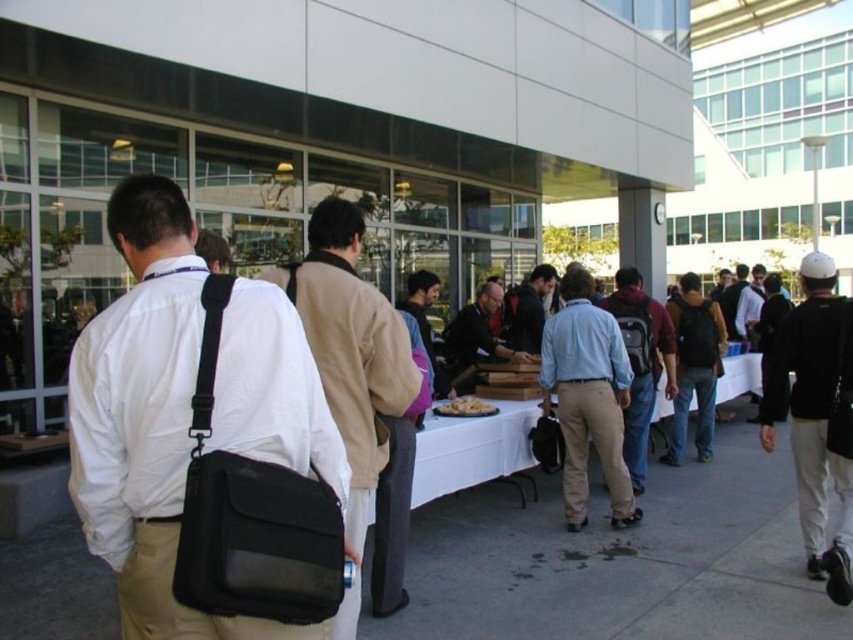
Question: Is black cotton jacket at right bigger than light blue cotton shirt at center?

Choices:
 (A) yes
 (B) no

Answer: (A)

Question: Where is black cotton jacket at right located in relation to dark blue backpack at center in the image?

Choices:
 (A) right
 (B) left

Answer: (A)

Question: Which is farther from the white cloth table at center?

Choices:
 (A) black fabric bag at center
 (B) black cotton jacket at right

Answer: (A)

Question: Among these objects, which one is nearest to the camera?

Choices:
 (A) black fabric bag at center
 (B) dark blue backpack at center
 (C) black cotton jacket at right

Answer: (A)

Question: Which point is farther to the camera?

Choices:
 (A) (714, 362)
 (B) (795, 476)
 (C) (457, 481)
 (D) (155, 424)

Answer: (A)

Question: Is light blue cotton shirt at center above dark blue backpack at center?

Choices:
 (A) yes
 (B) no

Answer: (B)